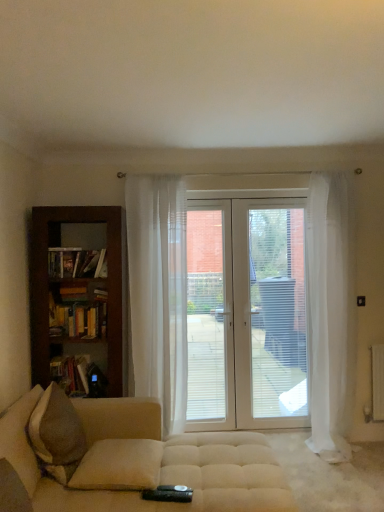
Identify the location of blank space above white glossy door at center (from a real-world perspective). The image size is (384, 512). (224, 201).